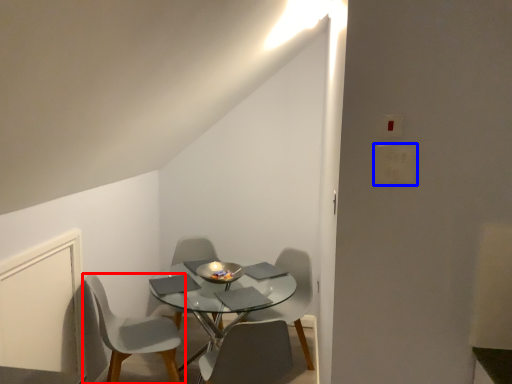
Question: Which of the following is the farthest to the observer, chair (highlighted by a red box) or light switch (highlighted by a blue box)?

Choices:
 (A) chair
 (B) light switch

Answer: (A)